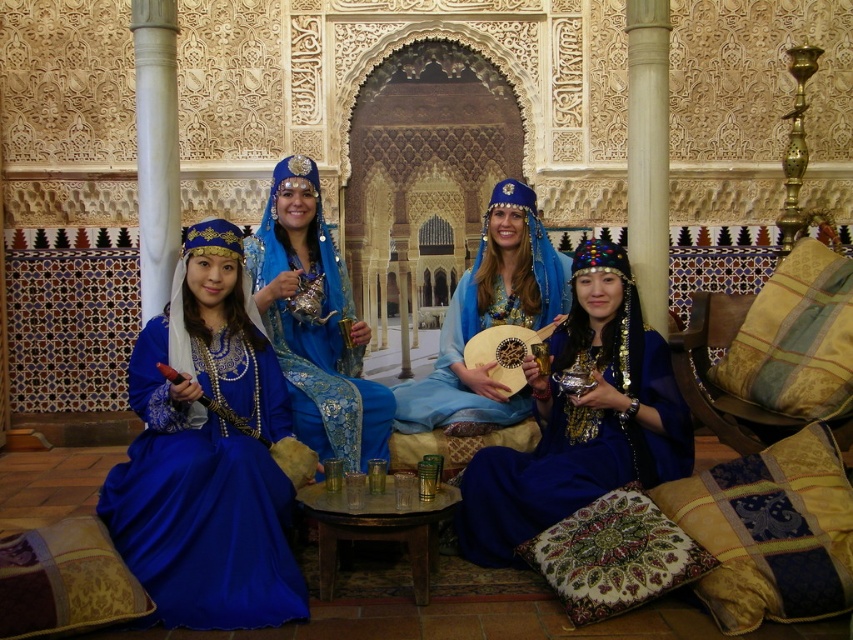
Question: Which is farther from the shiny blue dress at center?

Choices:
 (A) velvet patchwork pillow at lower right
 (B) gold-patterned fabric pillow at right
 (C) matte blue dress at center

Answer: (C)

Question: Which point is farther to the camera?

Choices:
 (A) shiny blue dress at center
 (B) matte blue dress at center
 (C) satin blue dress at center

Answer: (C)

Question: Which of the following is the closest to the observer?

Choices:
 (A) (837, 456)
 (B) (604, 474)
 (C) (183, 465)

Answer: (C)

Question: Is shiny blue dress at center in front of gold-patterned fabric pillow at right?

Choices:
 (A) no
 (B) yes

Answer: (B)

Question: Is matte blue dress at center bigger than satin blue dress at center?

Choices:
 (A) no
 (B) yes

Answer: (A)

Question: Is shiny blue dress at center positioned behind velvet patchwork pillow at lower right?

Choices:
 (A) no
 (B) yes

Answer: (B)